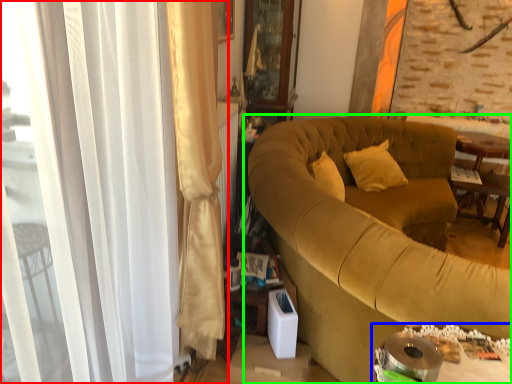
Question: Estimate the real-world distances between objects in this image. Which object is farther from curtain (highlighted by a red box), table (highlighted by a blue box) or studio couch (highlighted by a green box)?

Choices:
 (A) table
 (B) studio couch

Answer: (B)